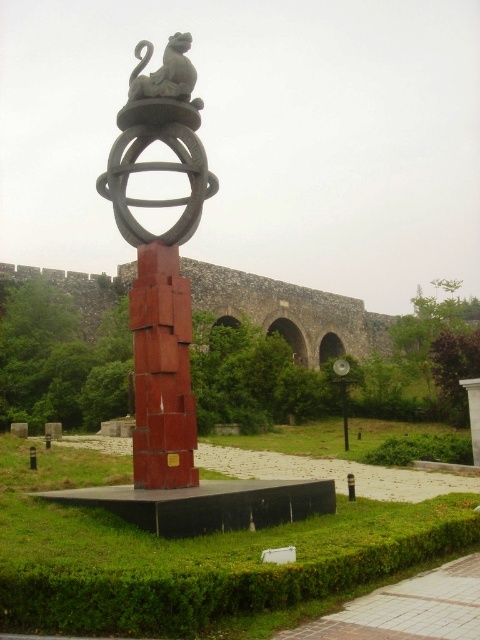
Does matte red stone sculpture at center have a greater width compared to matte gray stone statue at upper center?

Correct, the width of matte red stone sculpture at center exceeds that of matte gray stone statue at upper center.

This screenshot has width=480, height=640. I want to click on matte red stone sculpture at center, so click(160, 260).

Is red painted metal sculpture at center taller than matte gray stone statue at upper center?

Correct, red painted metal sculpture at center is much taller as matte gray stone statue at upper center.

Does red painted metal sculpture at center come behind matte gray stone statue at upper center?

No, red painted metal sculpture at center is closer to the viewer.

Does point (446, 509) come farther from viewer compared to point (162, 81)?

No, it is not.

The width and height of the screenshot is (480, 640). I want to click on red painted metal sculpture at center, so click(x=191, y=556).

Does red painted metal sculpture at center have a larger size compared to matte red stone sculpture at center?

Yes.

Is point (367, 429) positioned behind point (135, 365)?

Yes, it is behind point (135, 365).

Where is `red painted metal sculpture at center`? The width and height of the screenshot is (480, 640). red painted metal sculpture at center is located at coordinates (191, 556).